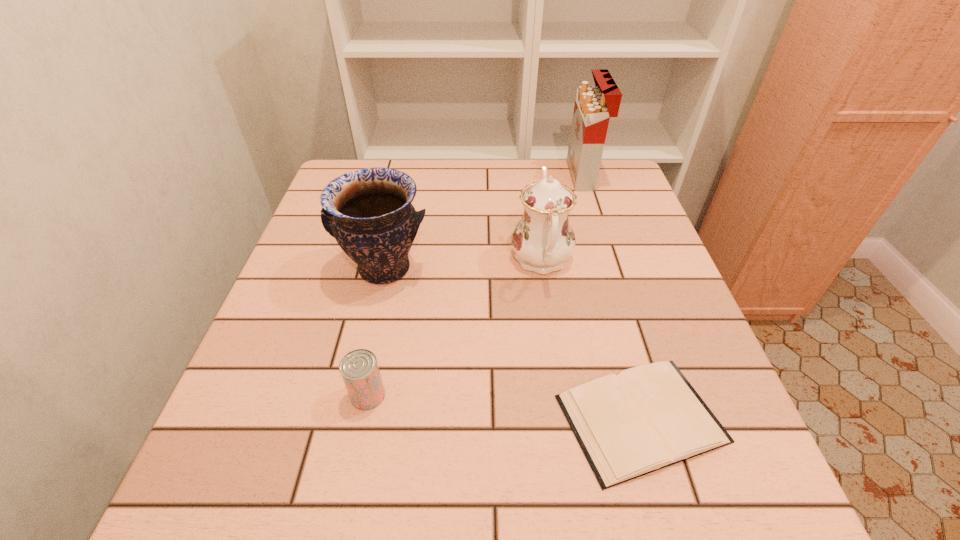
Locate an element on the screen. This screenshot has height=540, width=960. free space located 0.360m on the front handle of the pottery is located at coordinates (338, 473).

The width and height of the screenshot is (960, 540). What are the coordinates of `free space located 0.380m on the right of the second shortest object` in the screenshot? It's located at (606, 395).

At what (x,y) coordinates should I click in order to perform the action: click on free space located 0.230m on the left of the shortest object. Please return your answer as a coordinate pair (x, y). Looking at the image, I should click on (419, 418).

The image size is (960, 540). Find the location of `object that is at the far edge`. object that is at the far edge is located at coordinates (594, 105).

Locate an element on the screen. object that is at the near edge is located at coordinates (649, 417).

Locate an element on the screen. The width and height of the screenshot is (960, 540). object at the left edge is located at coordinates (369, 212).

Image resolution: width=960 pixels, height=540 pixels. Identify the location of cigarette case present at the right edge. (594, 105).

Locate an element on the screen. hardback book at the right edge is located at coordinates (649, 417).

Find the location of a particular element. The image size is (960, 540). object at the far right corner is located at coordinates (594, 105).

This screenshot has height=540, width=960. Identify the location of object that is at the near right corner. (649, 417).